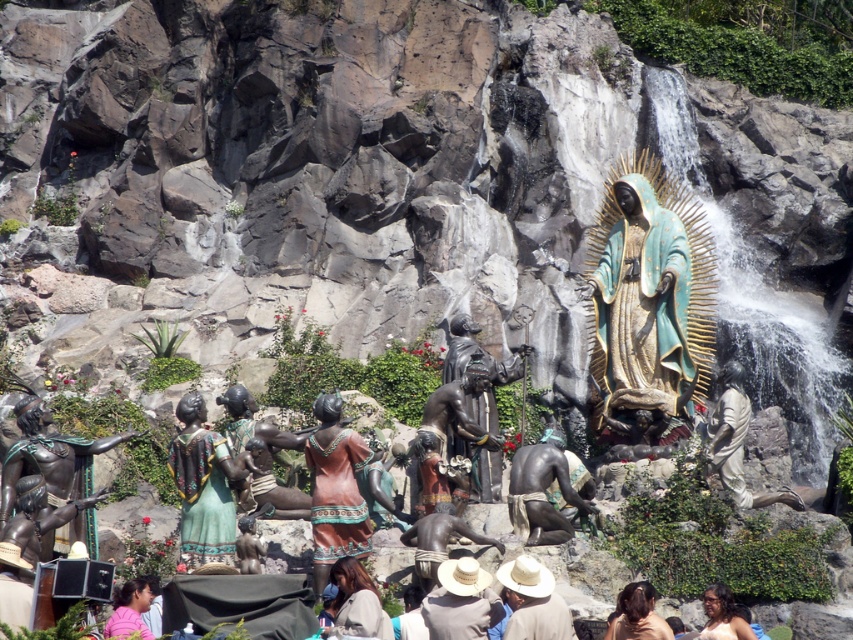
You are a tour guide explaining the layout of the outdoor sculpture garden. You mention the bronze statue at lower center. Where exactly is it positioned in relation to the central religious figure?

The bronze statue at lower center is positioned at coordinates point (x=541, y=492), which places it slightly to the right and below the central religious figure.